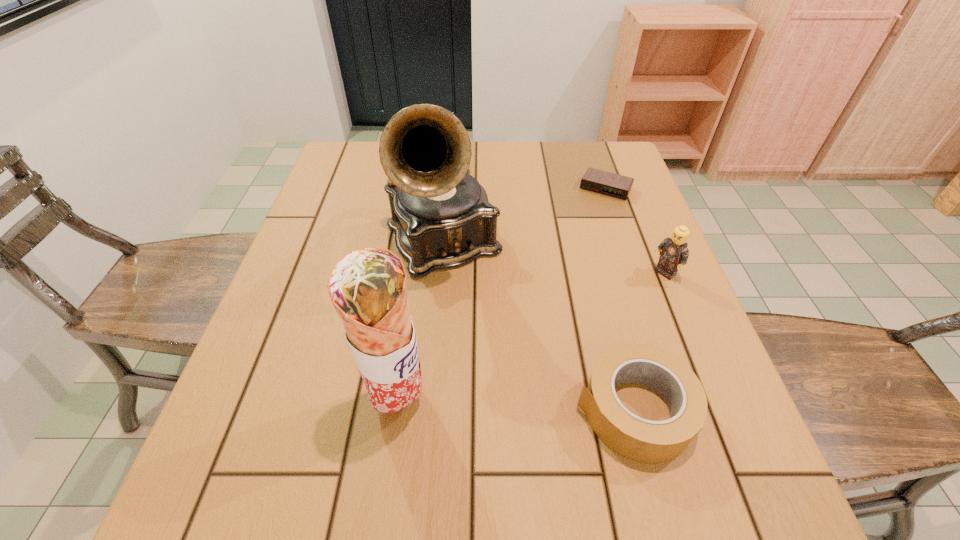
You are a GUI agent. You are given a task and a screenshot of the screen. Output one action in this format:
    pyautogui.click(x=<x>, y=<y>)
    Task: Click on the blank area located 0.260m on the front face of the shortest object
    The width and height of the screenshot is (960, 540).
    Given the screenshot: What is the action you would take?
    pyautogui.click(x=567, y=258)

Where is `free space located on the front face of the shortest object`? free space located on the front face of the shortest object is located at coordinates (590, 214).

This screenshot has height=540, width=960. I want to click on free region located 0.090m on the front face of the shortest object, so click(x=588, y=218).

You are a GUI agent. You are given a task and a screenshot of the screen. Output one action in this format:
    pyautogui.click(x=<x>, y=<y>)
    Task: Click on the vacant space located 0.320m in front of the third tallest object
    This screenshot has width=960, height=540.
    Given the screenshot: What is the action you would take?
    pyautogui.click(x=558, y=356)

What are the coordinates of `blank space located in front of the third tallest object` in the screenshot? It's located at (582, 338).

The width and height of the screenshot is (960, 540). What are the coordinates of `free spot located 0.310m in front of the third tallest object` in the screenshot? It's located at (562, 354).

Image resolution: width=960 pixels, height=540 pixels. What are the coordinates of `vacant space located 0.050m on the horn of the phonograph record` in the screenshot? It's located at (473, 301).

Where is `free space located on the horn of the phonograph record`? The height and width of the screenshot is (540, 960). free space located on the horn of the phonograph record is located at coordinates (548, 438).

You are a GUI agent. You are given a task and a screenshot of the screen. Output one action in this format:
    pyautogui.click(x=<x>, y=<y>)
    Task: Click on the free space located on the horn of the phonograph record
    Image resolution: width=960 pixels, height=540 pixels.
    Given the screenshot: What is the action you would take?
    pyautogui.click(x=473, y=301)

This screenshot has width=960, height=540. What are the coordinates of `object situated at the far edge` in the screenshot? It's located at (602, 182).